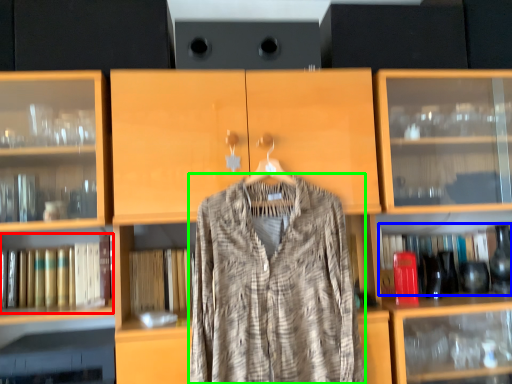
Question: Which object is positioned farthest from book (highlighted by a red box)? Select from book (highlighted by a blue box) and fancy dress (highlighted by a green box).

Choices:
 (A) book
 (B) fancy dress

Answer: (A)